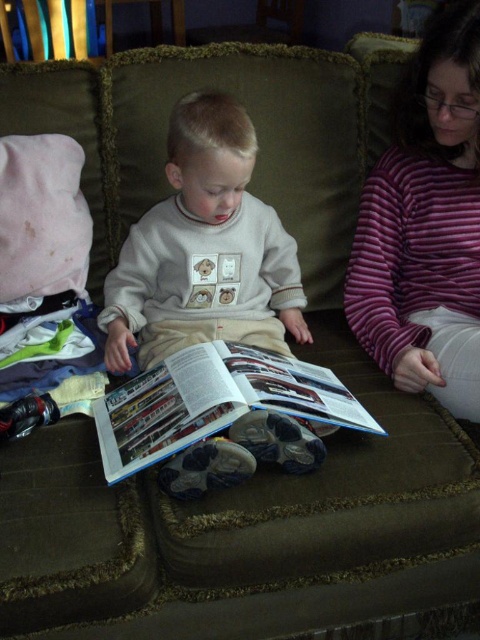
Question: Can you confirm if purple striped sweater at upper right is positioned to the left of matte paper magazine at center?

Choices:
 (A) yes
 (B) no

Answer: (B)

Question: Which point is farther to the camera?

Choices:
 (A) light gray cotton sweater at center
 (B) purple striped sweater at upper right

Answer: (A)

Question: In this image, where is light gray cotton sweater at center located relative to matte paper magazine at center?

Choices:
 (A) above
 (B) below

Answer: (A)

Question: Which of the following is the farthest from the observer?

Choices:
 (A) light gray cotton sweater at center
 (B) purple striped sweater at upper right
 (C) matte paper magazine at center

Answer: (A)

Question: Based on their relative distances, which object is farther from the light gray cotton sweater at center?

Choices:
 (A) purple striped sweater at upper right
 (B) matte paper magazine at center

Answer: (A)

Question: Is light gray cotton sweater at center closer to camera compared to matte paper magazine at center?

Choices:
 (A) yes
 (B) no

Answer: (B)